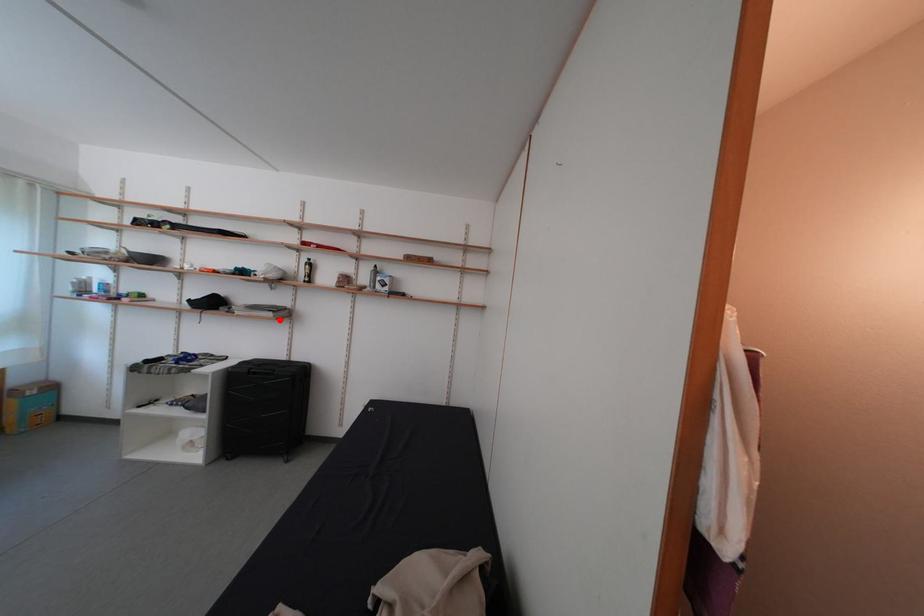
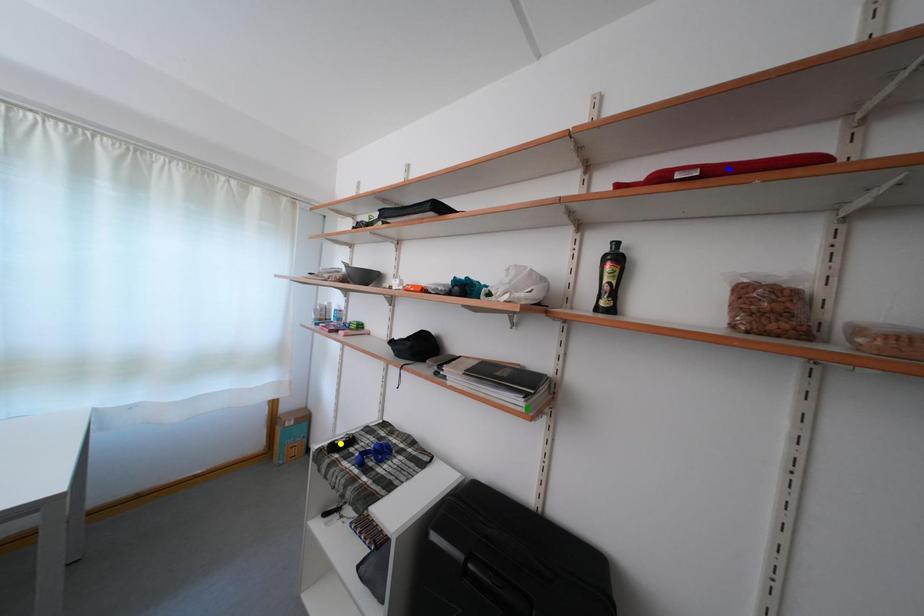
Question: I am providing you with two images of the same scene from different viewpoints. A red point is marked on the first image. You are given multiple points on the second image. Which spot in image 2 lines up with the point in image 1?

Choices:
 (A) blue point
 (B) green point
 (C) yellow point

Answer: (B)